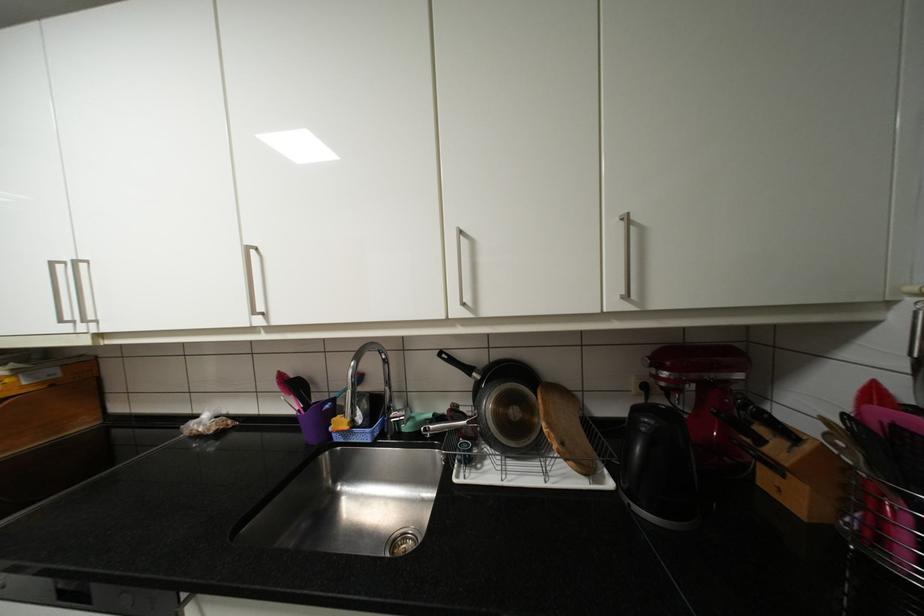
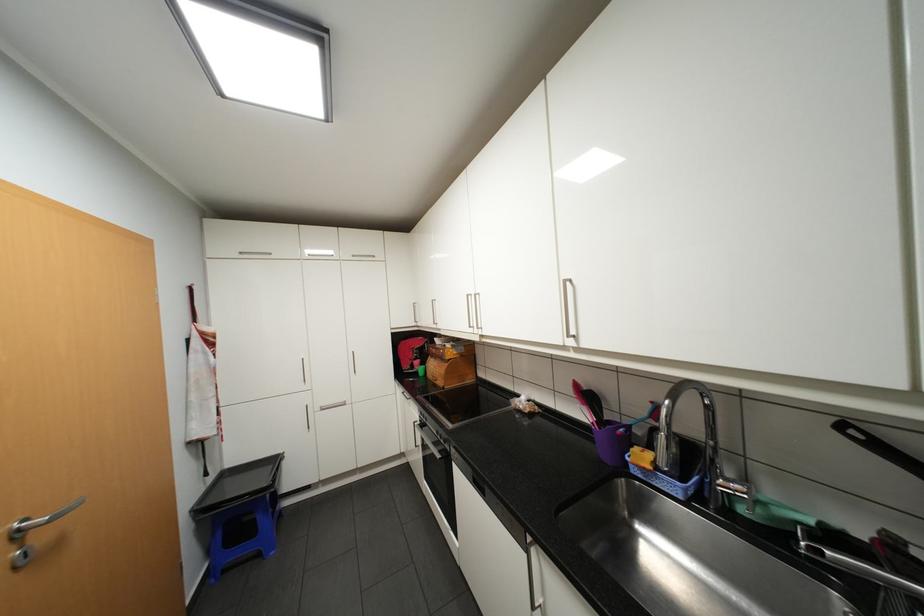
Where in the second image is the point corresponding to the point at 381,431 from the first image?

(694, 488)